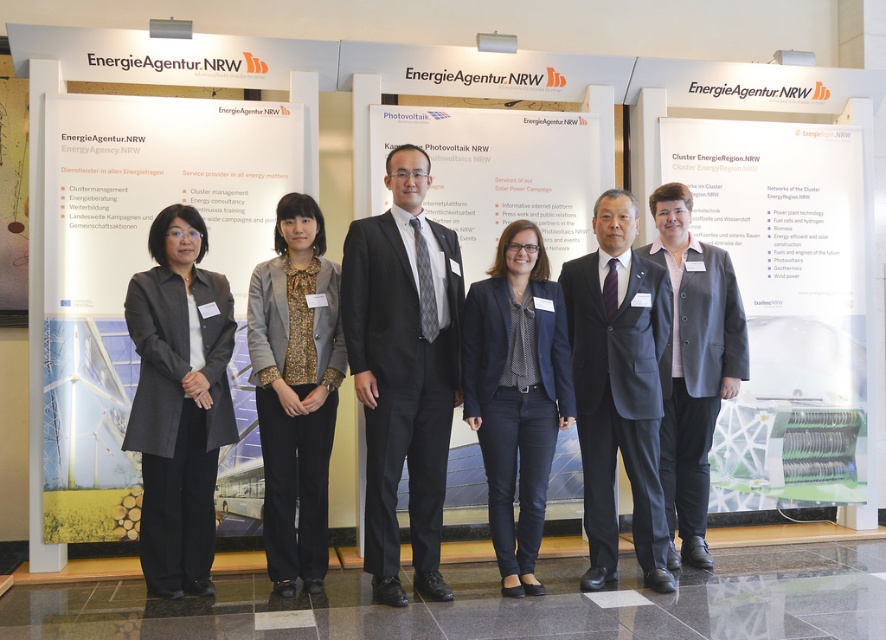
You are a photographer at the event and need to capture a photo that includes both the matte white poster at left and the dark gray matte blazer at center. Since you want to ensure both are in focus, you need to know which object is closer to you. Which one is closer?

The matte white poster at left is closer to you than the dark gray matte blazer at center because it is further to the viewer.

From the picture: You are organizing a photo shoot for an energy conference and need to ensure that the green matte solar panel at center and the dark gray matte blazer at center are both visible in the frame. Given their sizes, which object should you focus on to ensure both are in the frame without cropping either?

The green matte solar panel at center is larger than the dark gray matte blazer at center. To ensure both are visible without cropping, focus on framing the larger object first, which is the green matte solar panel at center, then adjust the camera angle to include the smaller dark gray matte blazer at center.